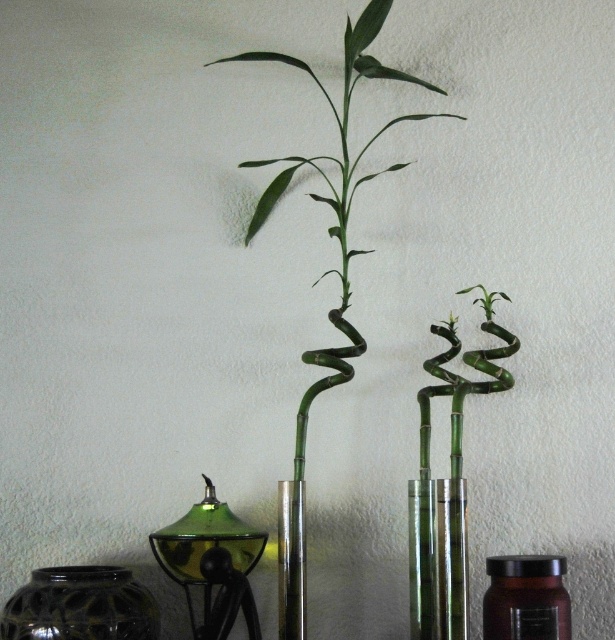
You are an interior designer planning to place a new decorative item between the green bamboo at center and the translucent amber jar at center. Which object should the new item be placed closer to if it needs to avoid being overshadowed by the taller object?

The new item should be placed closer to the translucent amber jar at center because the green bamboo at center is taller and could overshadow it.

You are arranging flowers in a minimalist room with a white wall. You have a clear glass vase at center and a translucent amber jar at center. According to the scene, which object is positioned to the left?

The clear glass vase at center is to the left of the translucent amber jar at center.